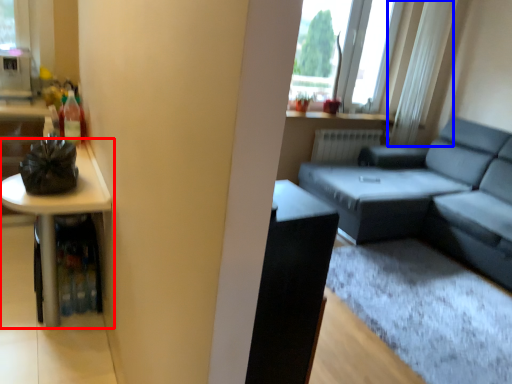
Question: Which point is closer to the camera, table (highlighted by a red box) or curtain (highlighted by a blue box)?

Choices:
 (A) table
 (B) curtain

Answer: (A)